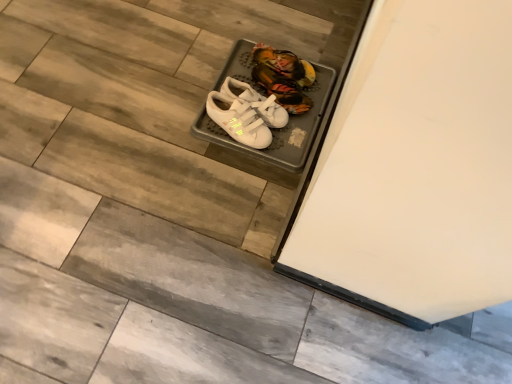
You are a GUI agent. You are given a task and a screenshot of the screen. Output one action in this format:
    pyautogui.click(x=<x>, y=<y>)
    Task: Click on the free space to the left of white velcro sneakers at center, the 3th footwear when ordered from front to back
    
    Given the screenshot: What is the action you would take?
    pyautogui.click(x=233, y=60)